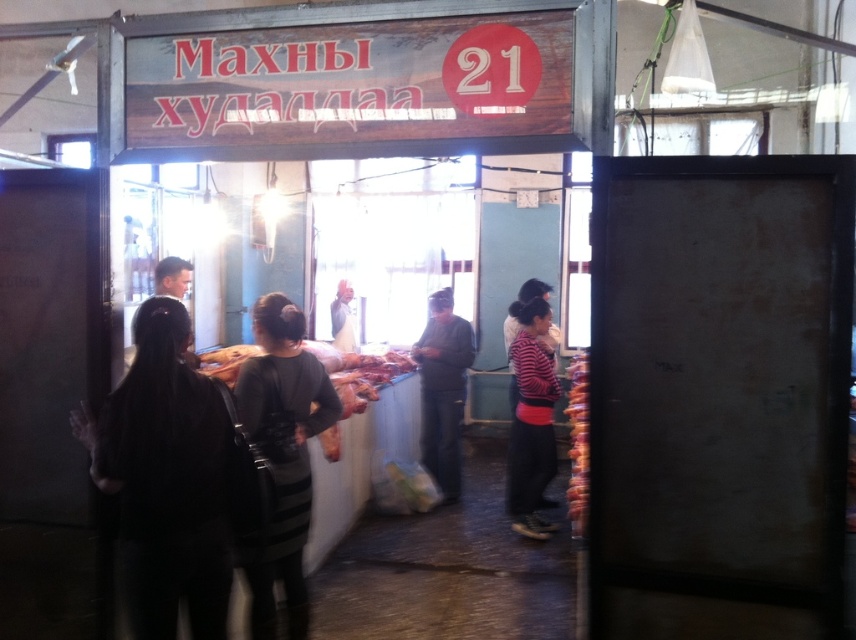
Question: Is raw meat at center bigger than blurred meat skewers at right?

Choices:
 (A) no
 (B) yes

Answer: (A)

Question: Is black fabric at left above blurred meat skewers at right?

Choices:
 (A) yes
 (B) no

Answer: (A)

Question: Is striped knit sweater at center closer to the viewer compared to raw meat at center?

Choices:
 (A) yes
 (B) no

Answer: (B)

Question: Which point appears farthest from the camera in this image?

Choices:
 (A) (431, 308)
 (B) (146, 417)

Answer: (A)

Question: Which of the following is the farthest from the observer?

Choices:
 (A) (331, 348)
 (B) (175, 308)
 (C) (539, 470)
 (D) (325, 381)

Answer: (A)

Question: Which object is farther from the camera taking this photo?

Choices:
 (A) black fabric at left
 (B) dark gray striped dress at center

Answer: (B)